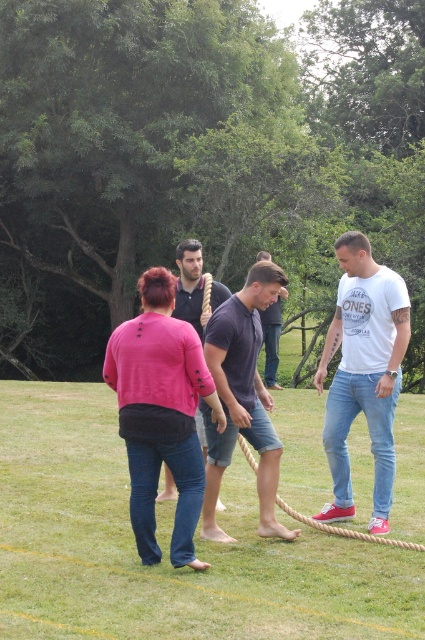
Between white cotton t-shirt at center and dark gray cotton t-shirt at center, which one has more height?

With more height is dark gray cotton t-shirt at center.

Is the position of white cotton t-shirt at center more distant than that of dark gray cotton t-shirt at center?

Yes.

Who is more forward, (336, 477) or (263, 529)?

Point (263, 529) is more forward.

Where is `white cotton t-shirt at center`? This screenshot has width=425, height=640. white cotton t-shirt at center is located at coordinates (363, 372).

Is denim jeans at center closer to camera compared to dark gray cotton t-shirt at center?

Yes, it is in front of dark gray cotton t-shirt at center.

The image size is (425, 640). What are the coordinates of `denim jeans at center` in the screenshot? It's located at (166, 547).

Is point (115, 460) in front of point (249, 371)?

That is False.

Where is `denim jeans at center`? denim jeans at center is located at coordinates click(x=166, y=547).

Consider the image. Can you confirm if white cotton t-shirt at center is positioned to the right of pink fabric shirt at center?

Yes, white cotton t-shirt at center is to the right of pink fabric shirt at center.

Is point (388, 403) behind point (187, 252)?

No, (388, 403) is closer to viewer.

What do you see at coordinates (363, 372) in the screenshot?
I see `white cotton t-shirt at center` at bounding box center [363, 372].

The width and height of the screenshot is (425, 640). What are the coordinates of `white cotton t-shirt at center` in the screenshot? It's located at (363, 372).